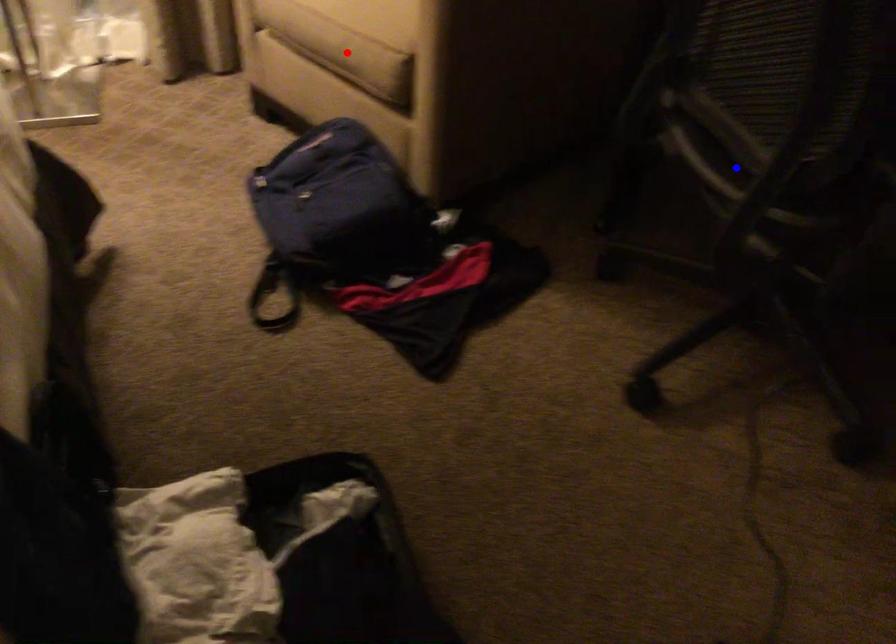
Question: In the image, two points are highlighted. Which point is nearer to the camera? Reply with the corresponding letter.

Choices:
 (A) blue point
 (B) red point

Answer: (A)